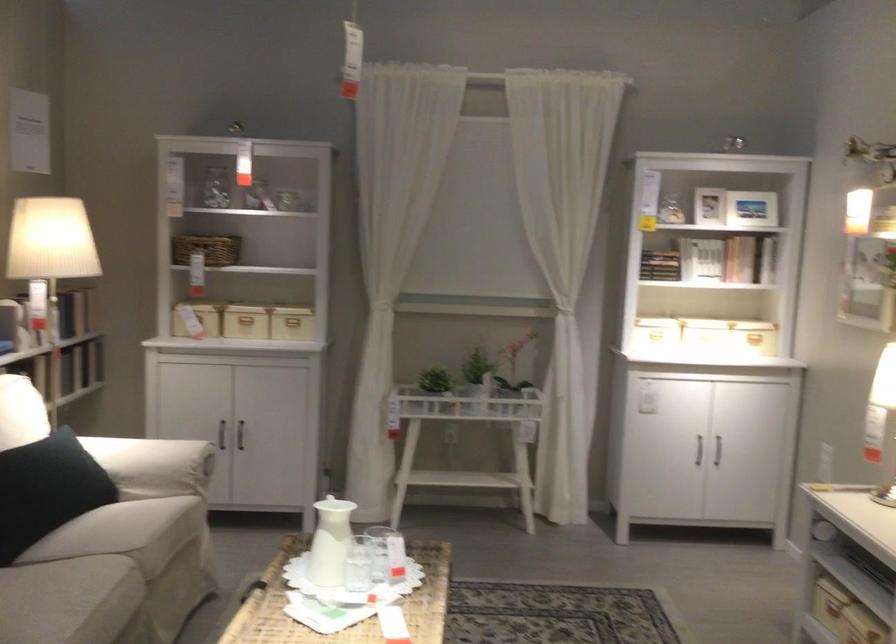
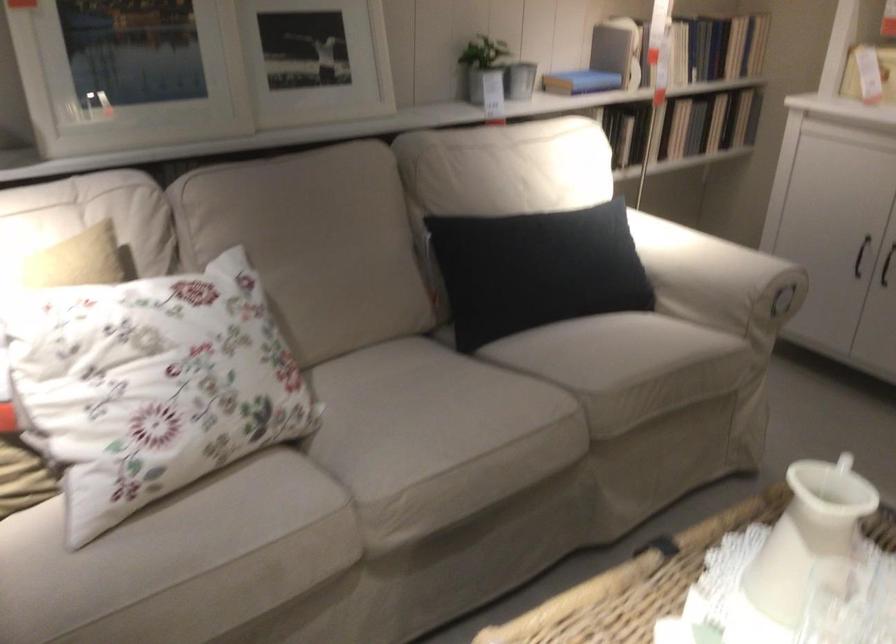
Locate, in the second image, the point that corresponds to (226,440) in the first image.

(860, 256)